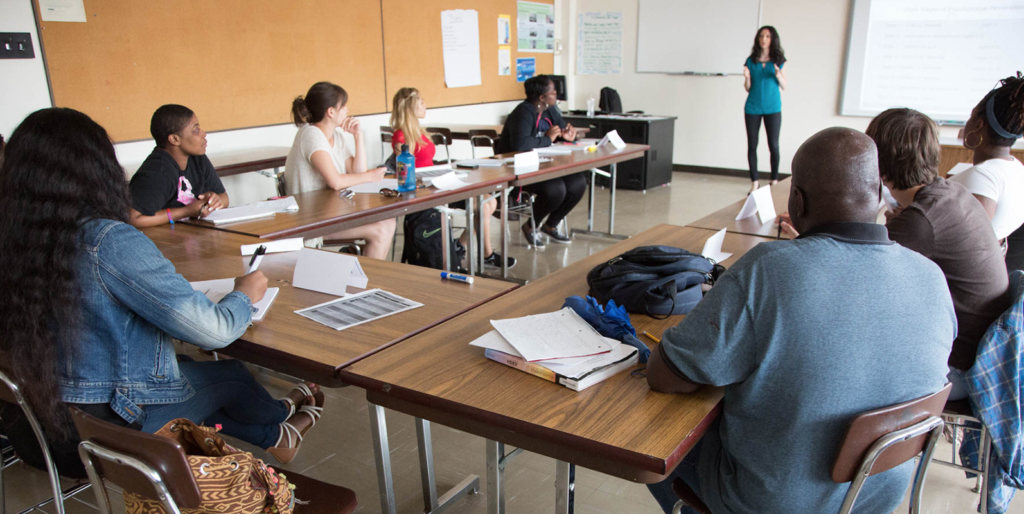
Find the location of a particular element. The width and height of the screenshot is (1024, 514). light switch is located at coordinates click(4, 50), click(22, 49).